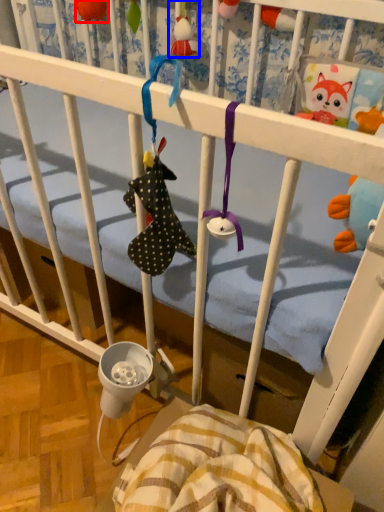
Question: Which object is closer to the camera taking this photo, toy (highlighted by a red box) or toy (highlighted by a blue box)?

Choices:
 (A) toy
 (B) toy

Answer: (B)